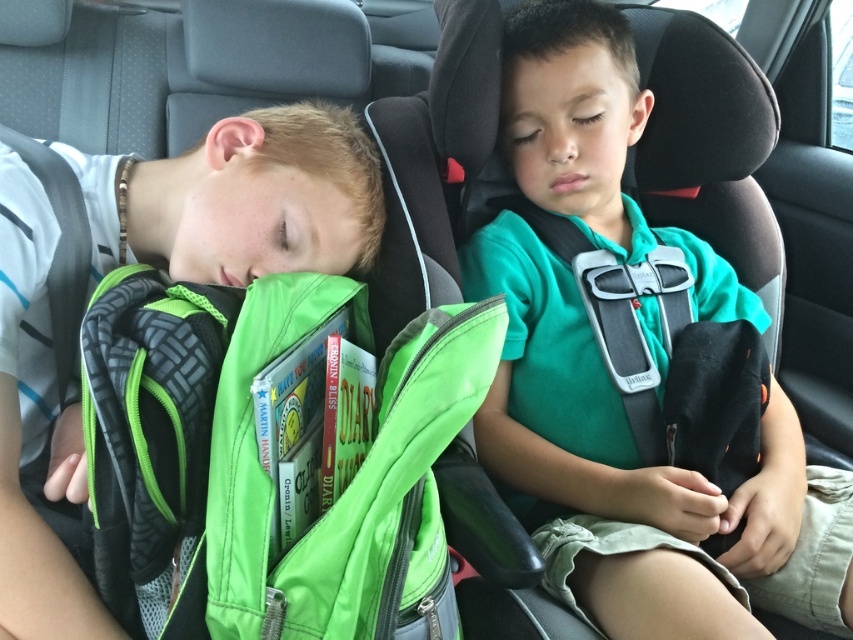
You are a safety inspector checking the distance between the green fabric backpack at left and the camera in a car. According to safety regulations, the maximum allowed distance between these items is 30 inches. Is the current distance compliant with the regulations?

The green fabric backpack at left and the camera are 31.86 inches apart, which exceeds the maximum allowed distance of 30 inches. Therefore, the current distance is not compliant with the regulations.

You are a delivery robot trying to place a small package on the green fabric backpack at left. The package requires a minimum of 28 inches of space. Can you safely place the package there?

The distance between the green fabric backpack at left and the camera is 31.86 inches, which is more than the required 28 inches. Therefore, the package can be safely placed there.